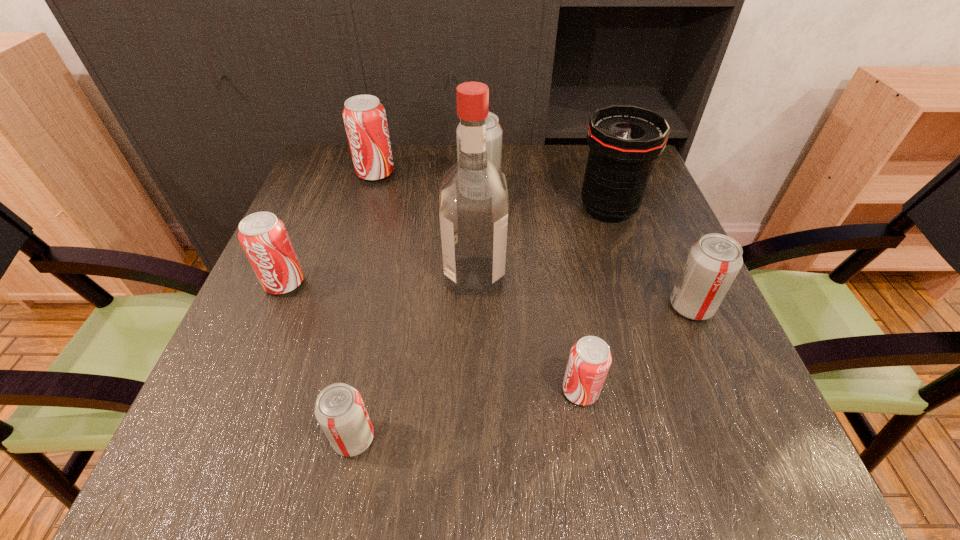
At what (x,y) coordinates should I click in order to perform the action: click on vacant position located 0.180m on the logo side of the second nearest object. Please return your answer as a coordinate pair (x, y). The height and width of the screenshot is (540, 960). Looking at the image, I should click on (452, 391).

This screenshot has height=540, width=960. I want to click on free point located 0.290m on the logo side of the second nearest object, so click(385, 391).

Where is `free region located 0.300m on the logo side of the second nearest object`? This screenshot has width=960, height=540. free region located 0.300m on the logo side of the second nearest object is located at coordinates (379, 391).

This screenshot has width=960, height=540. Find the location of `vacant position located 0.340m on the right of the third soda can from left to right`. vacant position located 0.340m on the right of the third soda can from left to right is located at coordinates (599, 438).

Where is `telephoto lens positioned at the far edge`? The height and width of the screenshot is (540, 960). telephoto lens positioned at the far edge is located at coordinates (624, 141).

Where is `object at the near edge`? The width and height of the screenshot is (960, 540). object at the near edge is located at coordinates (340, 411).

The image size is (960, 540). In order to click on telephoto lens present at the right edge in this screenshot , I will do `click(624, 141)`.

Find the location of a particular element. Image resolution: width=960 pixels, height=540 pixels. soda can located in the right edge section of the desktop is located at coordinates (713, 262).

This screenshot has width=960, height=540. Find the location of `object present at the far left corner`. object present at the far left corner is located at coordinates (364, 117).

Find the location of a particular element. object at the far right corner is located at coordinates (624, 141).